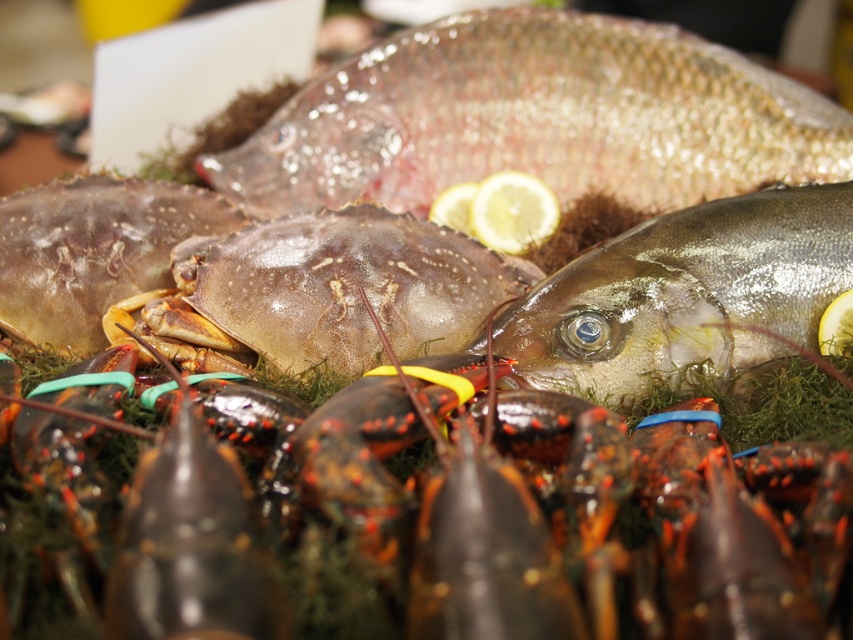
Question: Which of the following is the farthest from the observer?

Choices:
 (A) yellow matte lemon at center
 (B) shiny brown crab at center
 (C) translucent brown crab at center

Answer: (A)

Question: Which object appears farthest from the camera in this image?

Choices:
 (A) shiny silver fish at upper center
 (B) translucent brown crab at center
 (C) yellow matte lemon at center
 (D) shiny brown crab at center

Answer: (A)

Question: In this image, where is translucent brown crab at center located relative to yellow matte lemon at center?

Choices:
 (A) right
 (B) left

Answer: (B)

Question: Which object appears farthest from the camera in this image?

Choices:
 (A) yellow matte lemon at center
 (B) shiny silver fish at center
 (C) shiny silver fish at upper center
 (D) translucent brown crab at center

Answer: (C)

Question: Is translucent brown crab at center bigger than yellow matte lemon at center?

Choices:
 (A) yes
 (B) no

Answer: (A)

Question: Is shiny silver fish at center below shiny brown crab at center?

Choices:
 (A) no
 (B) yes

Answer: (B)